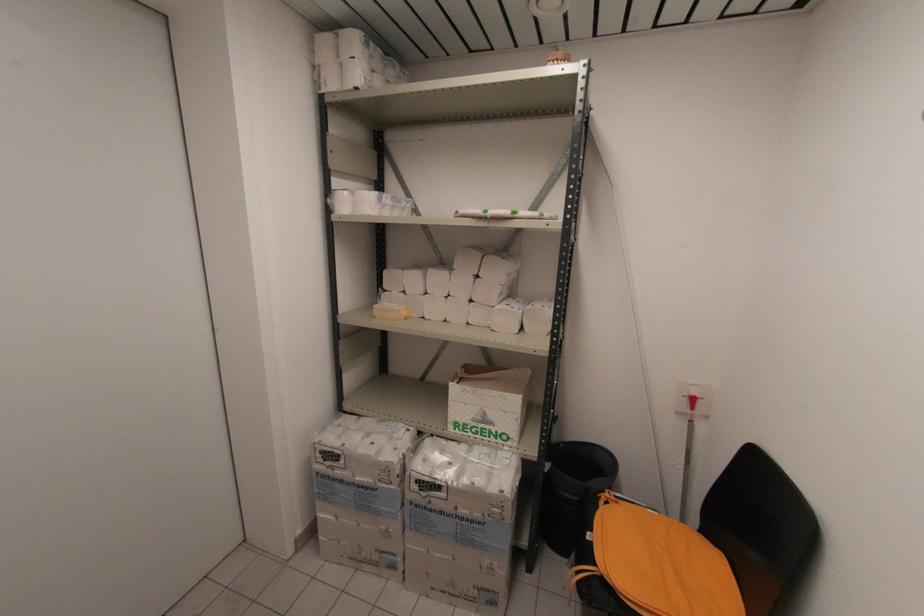
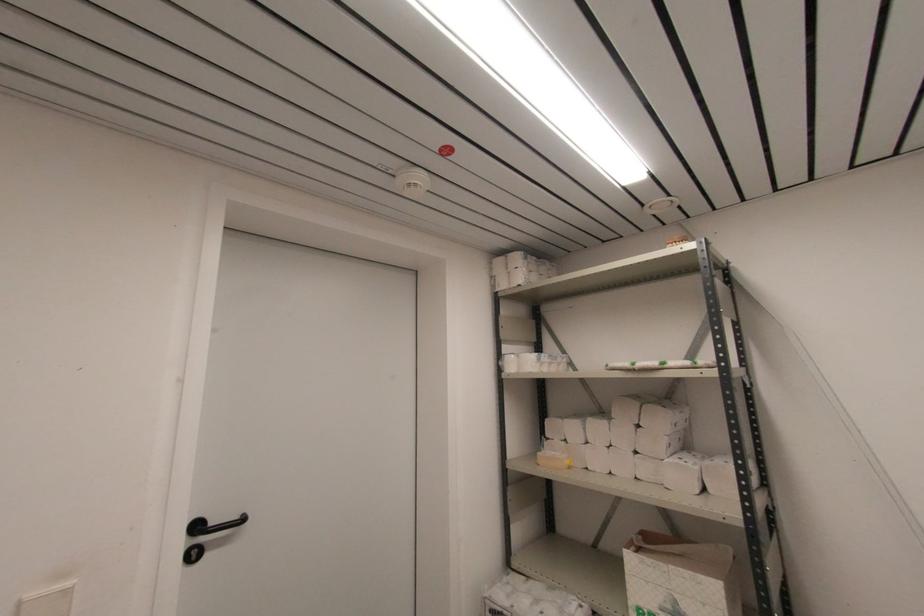
The point at (471, 301) is marked in the first image. Where is the corresponding point in the second image?

(637, 453)